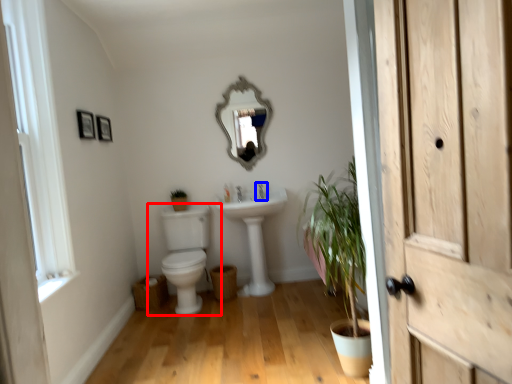
Question: Which object is closer to the camera taking this photo, toilet (highlighted by a red box) or tap (highlighted by a blue box)?

Choices:
 (A) toilet
 (B) tap

Answer: (A)